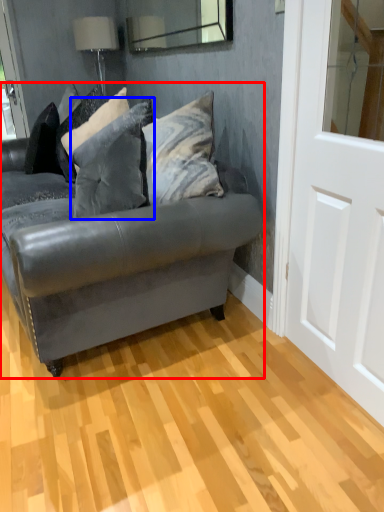
Question: Which point is closer to the camera, studio couch (highlighted by a red box) or pillow (highlighted by a blue box)?

Choices:
 (A) studio couch
 (B) pillow

Answer: (A)